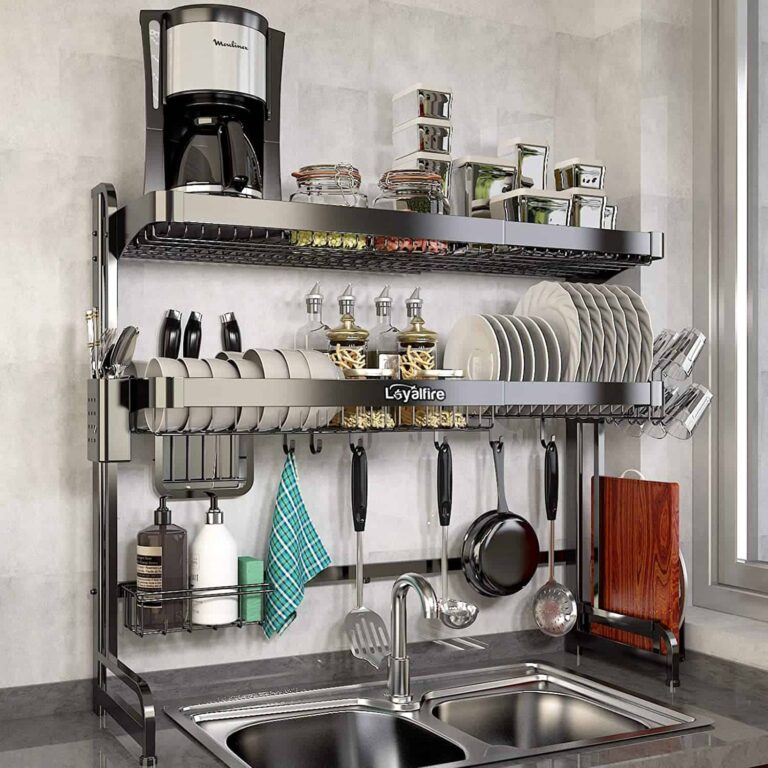
I want to click on dispenser, so click(164, 561), click(222, 545).